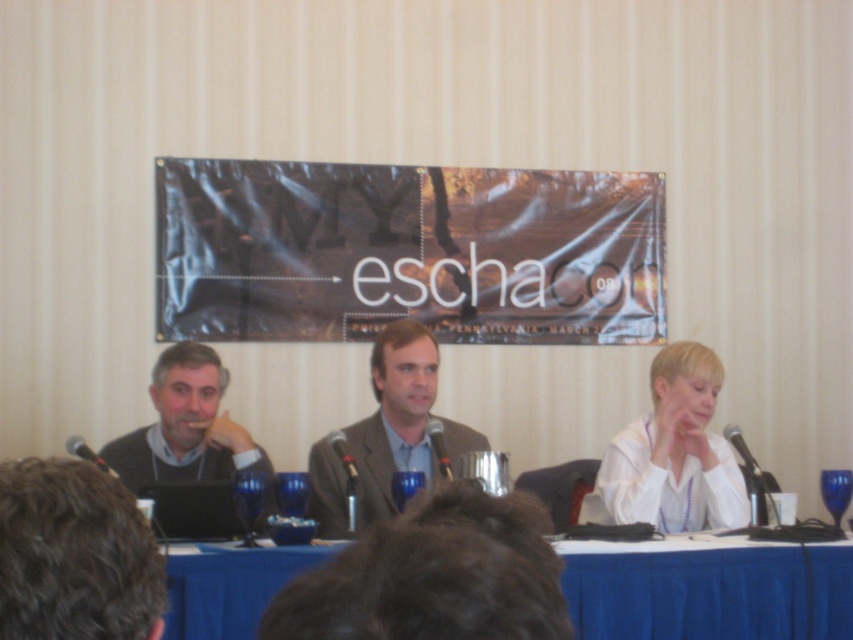
Question: Can you confirm if dark gray sweater at left is positioned above black matte microphone at center?

Choices:
 (A) yes
 (B) no

Answer: (A)

Question: Is white matte shirt at center closer to camera compared to black metallic microphone at center?

Choices:
 (A) no
 (B) yes

Answer: (A)

Question: Estimate the real-world distances between objects in this image. Which object is closer to the black matte microphone at center?

Choices:
 (A) black metallic microphone at center
 (B) white matte shirt at center
 (C) blue fabric table at center
 (D) black metallic microphone at left

Answer: (A)

Question: Does matte gray suit at center lie in front of black matte microphone at center?

Choices:
 (A) yes
 (B) no

Answer: (B)

Question: Which point is closer to the camera?

Choices:
 (A) black metallic microphone at center
 (B) matte gray suit at center

Answer: (A)

Question: Which point is farther from the camera taking this photo?

Choices:
 (A) (90, 448)
 (B) (705, 481)
 (C) (405, 320)

Answer: (A)